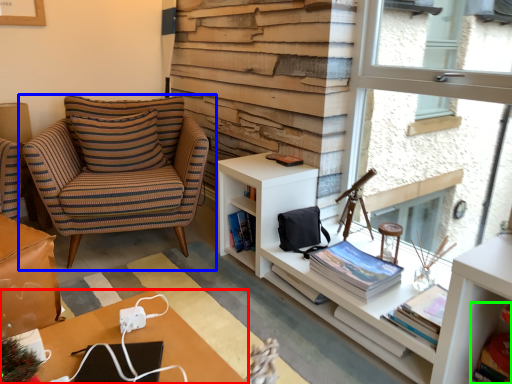
Question: Which object is positioned closest to desk (highlighted by a red box)? Select from chair (highlighted by a blue box) and book (highlighted by a green box).

Choices:
 (A) chair
 (B) book

Answer: (B)